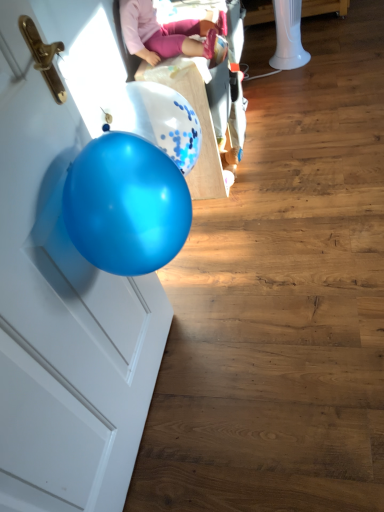
Locate an element on the screen. Image resolution: width=384 pixels, height=512 pixels. free region under glossy blue balloon at left (from a real-world perspective) is located at coordinates (153, 415).